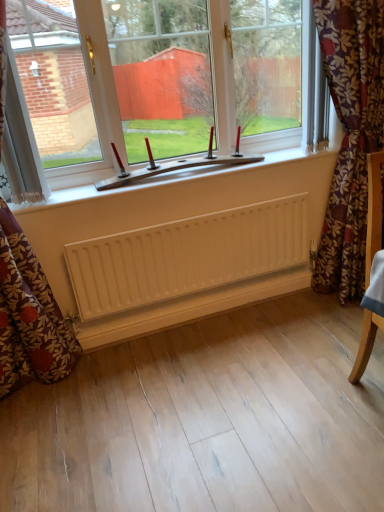
Question: Is floral fabric curtain at left, acting as the second curtain starting from the right, further to the viewer compared to white plastic window at center?

Choices:
 (A) no
 (B) yes

Answer: (A)

Question: Can you see floral fabric curtain at left, acting as the second curtain starting from the right, touching white plastic window at center?

Choices:
 (A) yes
 (B) no

Answer: (B)

Question: Can you confirm if floral fabric curtain at left, acting as the second curtain starting from the right, is positioned to the right of white plastic window at center?

Choices:
 (A) no
 (B) yes

Answer: (A)

Question: Is floral fabric curtain at left, positioned as the 2th curtain in left-to-right order, surrounding white plastic window at center?

Choices:
 (A) no
 (B) yes

Answer: (A)

Question: From the image's perspective, is floral fabric curtain at left, acting as the second curtain starting from the right, below white plastic window at center?

Choices:
 (A) yes
 (B) no

Answer: (A)

Question: Considering the positions of point (150, 40) and point (14, 81), is point (150, 40) closer or farther from the camera than point (14, 81)?

Choices:
 (A) closer
 (B) farther

Answer: (B)

Question: In terms of height, does white plastic window at center look taller or shorter compared to white textured curtain at left, marked as the 1th curtain in a left-to-right arrangement?

Choices:
 (A) tall
 (B) short

Answer: (A)

Question: In the image, is white plastic window at center on the left side or the right side of white textured curtain at left, marked as the 1th curtain in a left-to-right arrangement?

Choices:
 (A) right
 (B) left

Answer: (A)

Question: From the image's perspective, is white plastic window at center above or below white textured curtain at left, which is counted as the third curtain, starting from the right?

Choices:
 (A) above
 (B) below

Answer: (A)

Question: From a real-world perspective, relative to floral fabric curtain at right, the first curtain when ordered from right to left, is white plastic window at center vertically above or below?

Choices:
 (A) below
 (B) above

Answer: (B)

Question: From the image's perspective, relative to floral fabric curtain at right, the first curtain when ordered from right to left, is white plastic window at center above or below?

Choices:
 (A) above
 (B) below

Answer: (A)

Question: Is point (142, 124) closer or farther from the camera than point (354, 237)?

Choices:
 (A) closer
 (B) farther

Answer: (A)

Question: Do you think white plastic window at center is within floral fabric curtain at right, which is the third curtain in left-to-right order, or outside of it?

Choices:
 (A) outside
 (B) inside

Answer: (A)

Question: From the image's perspective, is white plastic window at center located above or below white matte radiator at center?

Choices:
 (A) below
 (B) above

Answer: (B)

Question: In terms of size, does white plastic window at center appear bigger or smaller than white matte radiator at center?

Choices:
 (A) small
 (B) big

Answer: (B)